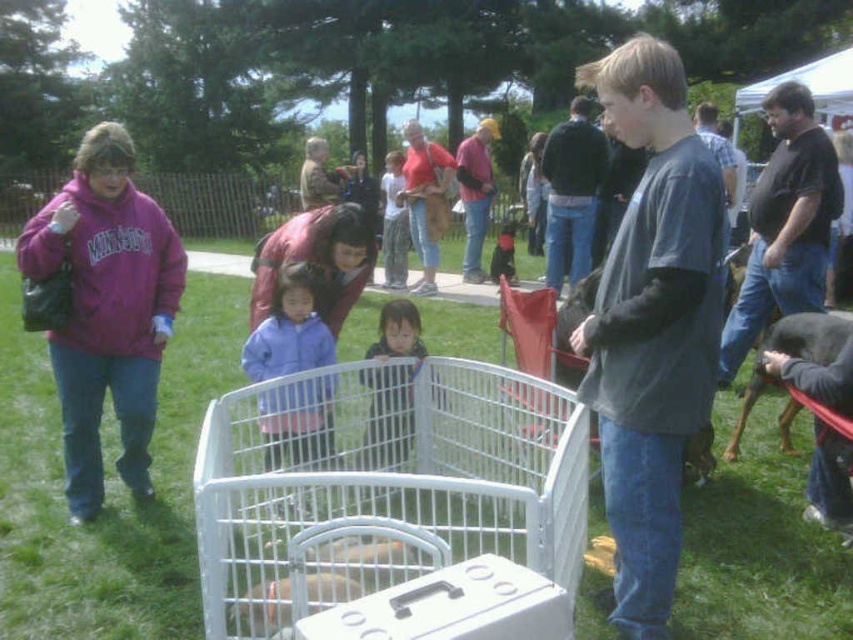
Does point (113, 196) lie in front of point (750, 404)?

Yes, it is in front of point (750, 404).

Who is more forward, (68, 432) or (764, 385)?

Point (68, 432) is more forward.

The image size is (853, 640). Find the location of `matte purple sweatshirt at left`. matte purple sweatshirt at left is located at coordinates (106, 308).

Does dark gray long-sleeved shirt at center have a lesser width compared to matte purple sweatshirt at left?

Yes.

Can you confirm if dark gray long-sleeved shirt at center is wider than matte purple sweatshirt at left?

Incorrect, dark gray long-sleeved shirt at center's width does not surpass matte purple sweatshirt at left's.

Is point (653, 625) farther from camera compared to point (142, 426)?

No.

At what (x,y) coordinates should I click in order to perform the action: click on dark gray long-sleeved shirt at center. Please return your answer as a coordinate pair (x, y). The height and width of the screenshot is (640, 853). Looking at the image, I should click on coord(653,324).

Between dark blue fabric jacket at center and black glossy dog at right, which one has more height?

Standing taller between the two is dark blue fabric jacket at center.

Where is `dark blue fabric jacket at center`? The image size is (853, 640). dark blue fabric jacket at center is located at coordinates (387, 417).

Between point (392, 401) and point (827, 356), which one is positioned behind?

Point (392, 401)

At what (x,y) coordinates should I click in order to perform the action: click on dark blue fabric jacket at center. Please return your answer as a coordinate pair (x, y). Image resolution: width=853 pixels, height=640 pixels. Looking at the image, I should click on (387, 417).